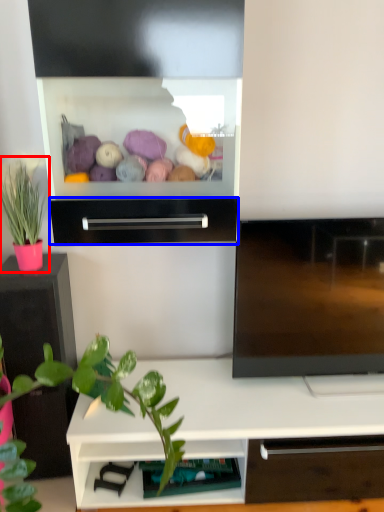
Question: Among these objects, which one is nearest to the camera, houseplant (highlighted by a red box) or drawer (highlighted by a blue box)?

Choices:
 (A) houseplant
 (B) drawer

Answer: (B)